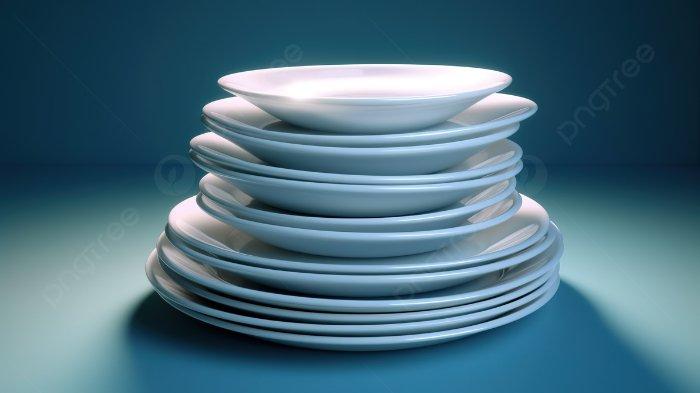
This screenshot has height=393, width=700. In order to click on flat plates in this screenshot , I will do `click(195, 226)`, `click(248, 267)`, `click(214, 273)`, `click(223, 295)`, `click(204, 307)`, `click(211, 321)`.